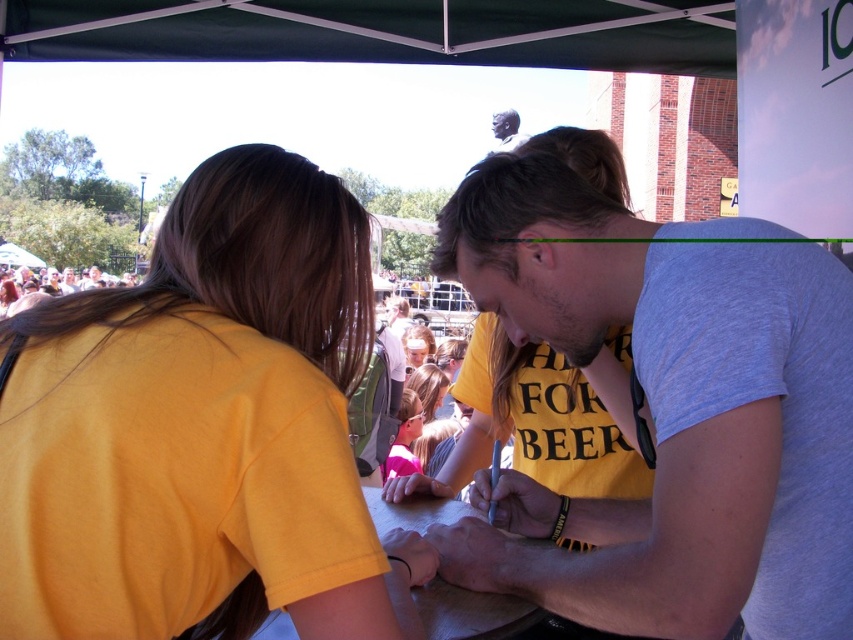
Between yellow matte shirt at upper left and matte black pen at center, which one is positioned lower?

matte black pen at center is lower down.

Does yellow matte shirt at upper left appear under matte black pen at center?

Actually, yellow matte shirt at upper left is above matte black pen at center.

Describe the element at coordinates (183, 401) in the screenshot. The height and width of the screenshot is (640, 853). I see `yellow matte shirt at upper left` at that location.

The height and width of the screenshot is (640, 853). Find the location of `yellow matte shirt at upper left`. yellow matte shirt at upper left is located at coordinates click(183, 401).

Does gray cotton shirt at center lie behind matte pink shirt at center?

No, gray cotton shirt at center is in front of matte pink shirt at center.

In the scene shown: Is gray cotton shirt at center above matte pink shirt at center?

Yes.

Image resolution: width=853 pixels, height=640 pixels. I want to click on gray cotton shirt at center, so click(x=674, y=410).

Identify the location of gray cotton shirt at center. This screenshot has height=640, width=853. (674, 410).

Which of these two, green fabric canopy at upper center or matte black face at upper center, stands taller?

matte black face at upper center is taller.

Is green fabric canopy at upper center bigger than matte black face at upper center?

No.

Is point (242, 29) closer to camera compared to point (503, 145)?

Yes, it is.

Locate an element on the screen. Image resolution: width=853 pixels, height=640 pixels. green fabric canopy at upper center is located at coordinates [x=380, y=32].